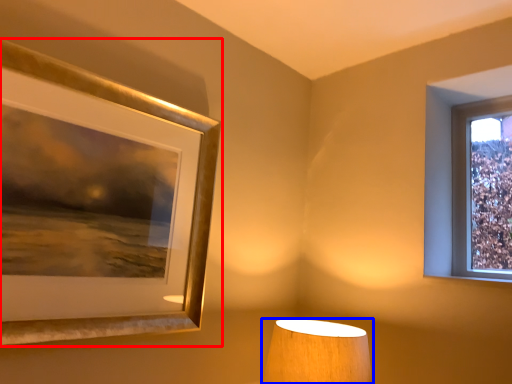
Question: Which point is further to the camera, picture frame (highlighted by a red box) or lamp (highlighted by a blue box)?

Choices:
 (A) picture frame
 (B) lamp

Answer: (B)